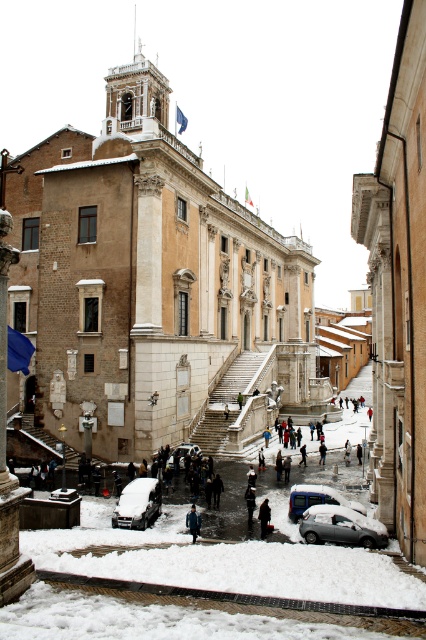
Question: Estimate the real-world distances between objects in this image. Which object is farther from the blue denim jacket at center?

Choices:
 (A) sleek silver sedan at center
 (B) metallic silver car at center

Answer: (B)

Question: In this image, where is sleek silver sedan at center located relative to metallic silver car at center?

Choices:
 (A) left
 (B) right

Answer: (A)

Question: Can you confirm if blue denim jacket at center is positioned above dark gray fabric coat at lower center?

Choices:
 (A) yes
 (B) no

Answer: (A)

Question: Among these points, which one is nearest to the camera?

Choices:
 (A) (245, 381)
 (B) (308, 488)

Answer: (B)

Question: Which of the following is the closest to the observer?

Choices:
 (A) silver metallic car at lower center
 (B) metallic silver car at center
 (C) sleek silver sedan at center

Answer: (A)

Question: Is white marble stairs at center bigger than dark gray fabric coat at lower center?

Choices:
 (A) yes
 (B) no

Answer: (A)